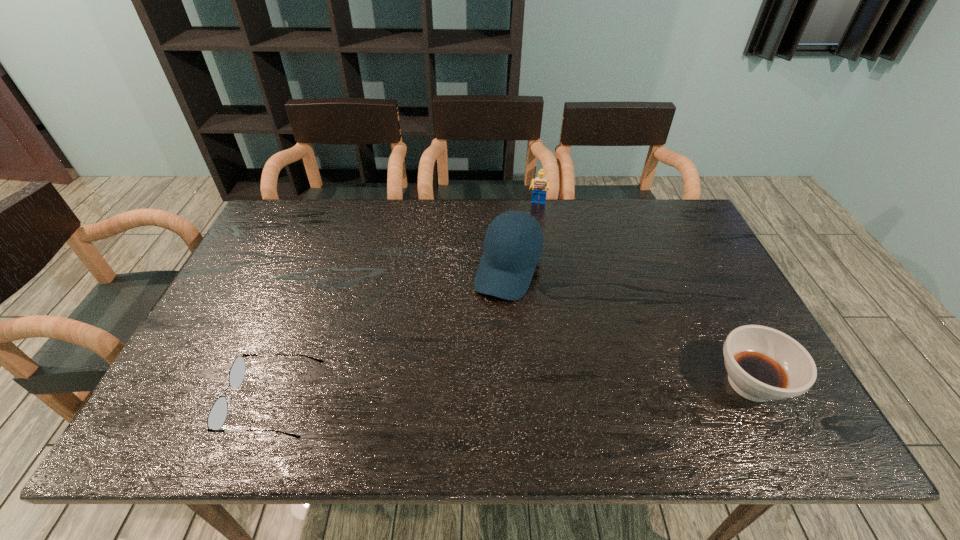
Identify the location of vacant point located on the lenses of the spectacles. The height and width of the screenshot is (540, 960). (205, 401).

Find the location of a particular element. The width and height of the screenshot is (960, 540). vacant space located 0.400m on the left of the rightmost object is located at coordinates (540, 383).

Locate an element on the screen. The width and height of the screenshot is (960, 540). free space located 0.170m on the front-facing side of the baseball cap is located at coordinates (478, 349).

Where is `vacant space located on the front-facing side of the baseball cap`? This screenshot has width=960, height=540. vacant space located on the front-facing side of the baseball cap is located at coordinates (464, 382).

The width and height of the screenshot is (960, 540). I want to click on free space located 0.080m on the front-facing side of the baseball cap, so click(490, 323).

Locate an element on the screen. free space located 0.170m on the face of the third shortest object is located at coordinates (532, 242).

Find the location of `free space located 0.270m on the face of the third shortest object`. free space located 0.270m on the face of the third shortest object is located at coordinates (528, 264).

Locate an element on the screen. The image size is (960, 540). free region located 0.340m on the face of the third shortest object is located at coordinates (526, 280).

In order to click on baseball cap situated at the far edge in this screenshot , I will do `click(513, 243)`.

Find the location of a particular element. Lego that is positioned at the far edge is located at coordinates (540, 185).